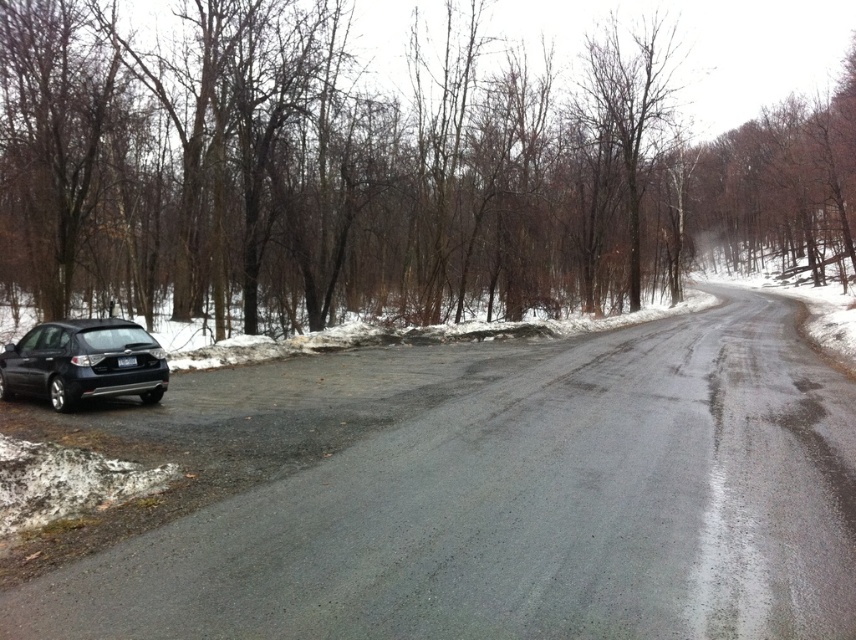
You are a delivery driver who needs to park your truck, which is 2 meters tall, on this rural road. You see the black matte car at left and the satin black hatchback at lower left. Which vehicle can you safely park behind without blocking the road completely?

The black matte car at left has a lesser height compared to satin black hatchback at lower left. Since your truck is 2 meters tall, you can safely park behind the satin black hatchback at lower left because it is taller and less likely to block the road completely when parked.

You are a pedestrian standing on the road and want to cross to the other side. You see a brown matte tree at left and a black matte car at left. Which object is closer to you, the pedestrian, based on their heights?

The brown matte tree at left is taller than the black matte car at left, so the car is closer to you since taller objects are typically further away in such scenes.